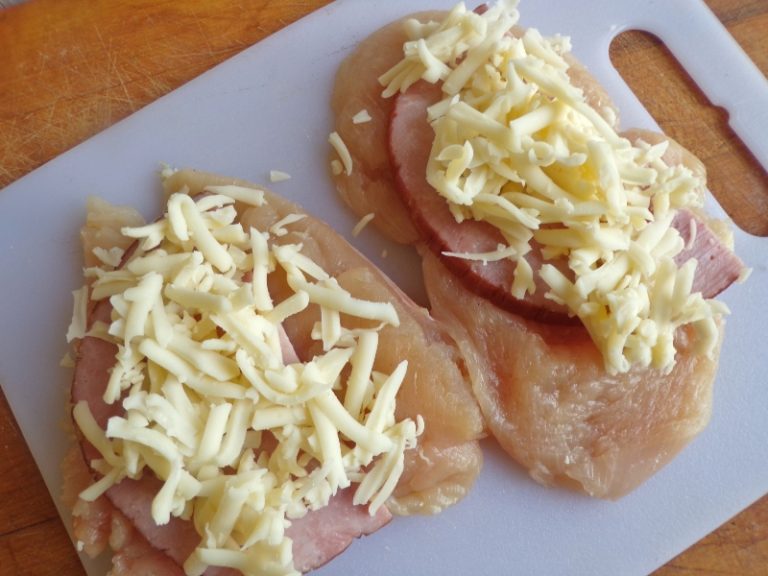
Locate an element on the screen. The width and height of the screenshot is (768, 576). scratches on surface is located at coordinates (55, 113), (84, 103), (103, 98), (128, 77), (147, 70).